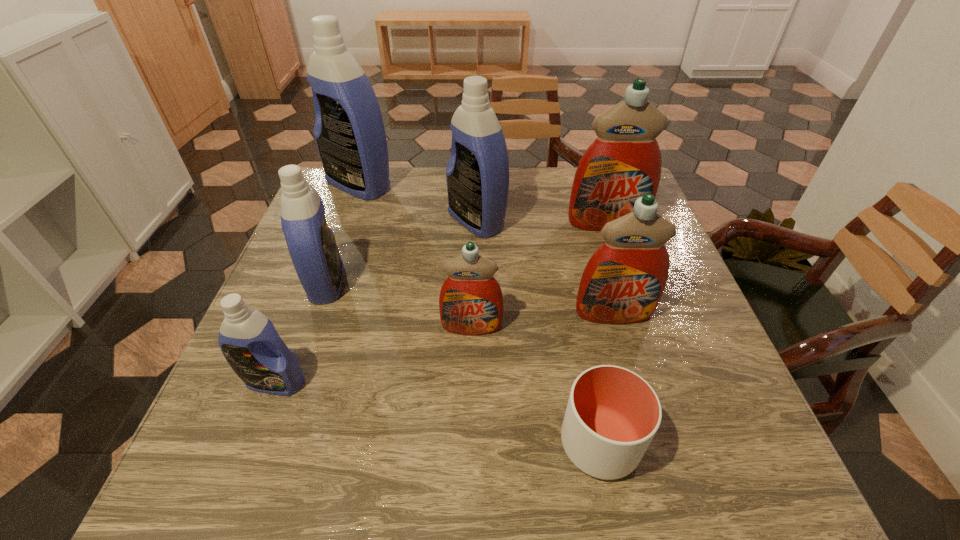
Locate an element on the screen. the tallest object is located at coordinates pos(349,131).

What are the coordinates of `the biggest blue detergent` in the screenshot? It's located at (349, 131).

Locate an element on the screen. Image resolution: width=960 pixels, height=540 pixels. the second biggest blue detergent is located at coordinates (477, 174).

Locate an element on the screen. the farthest red detergent is located at coordinates (624, 162).

The width and height of the screenshot is (960, 540). In order to click on the second nearest blue detergent in this screenshot , I will do `click(311, 243)`.

This screenshot has height=540, width=960. What are the coordinates of `the second biggest red detergent` in the screenshot? It's located at (622, 283).

The height and width of the screenshot is (540, 960). In order to click on the nearest detergent in this screenshot , I will do `click(248, 340)`.

Where is `the smallest blue detergent`? Image resolution: width=960 pixels, height=540 pixels. the smallest blue detergent is located at coordinates (248, 340).

Identify the location of the smallest red detergent. Image resolution: width=960 pixels, height=540 pixels. (471, 302).

At what (x,y) coordinates should I click in order to perform the action: click on the nearest object. Please return your answer as a coordinate pair (x, y). Looking at the image, I should click on (612, 415).